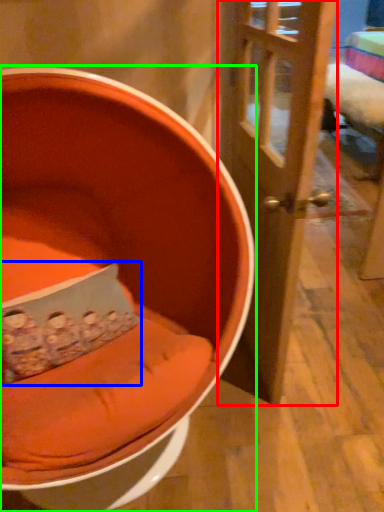
Question: Which object is positioned farthest from door (highlighted by a red box)? Select from pillow (highlighted by a blue box) and chair (highlighted by a green box).

Choices:
 (A) pillow
 (B) chair

Answer: (A)